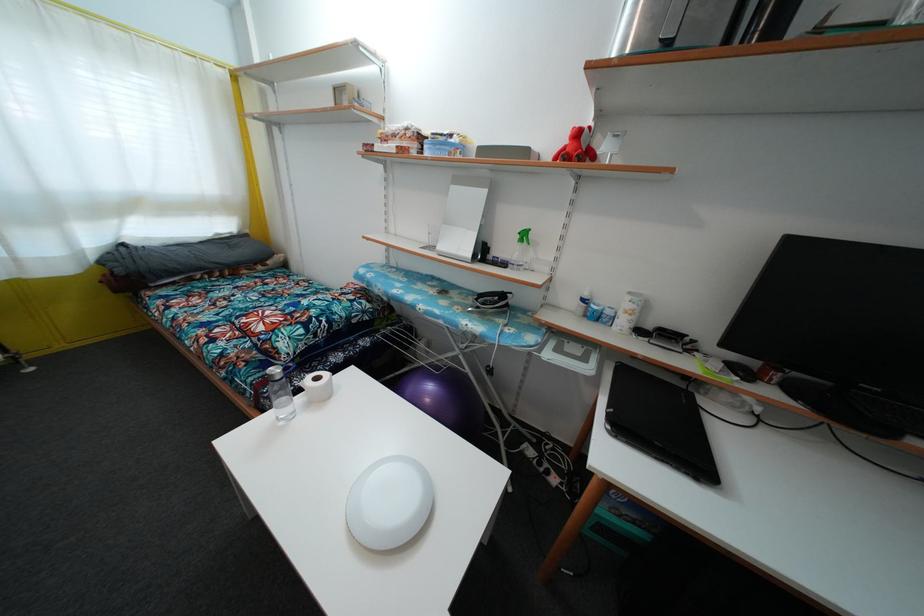
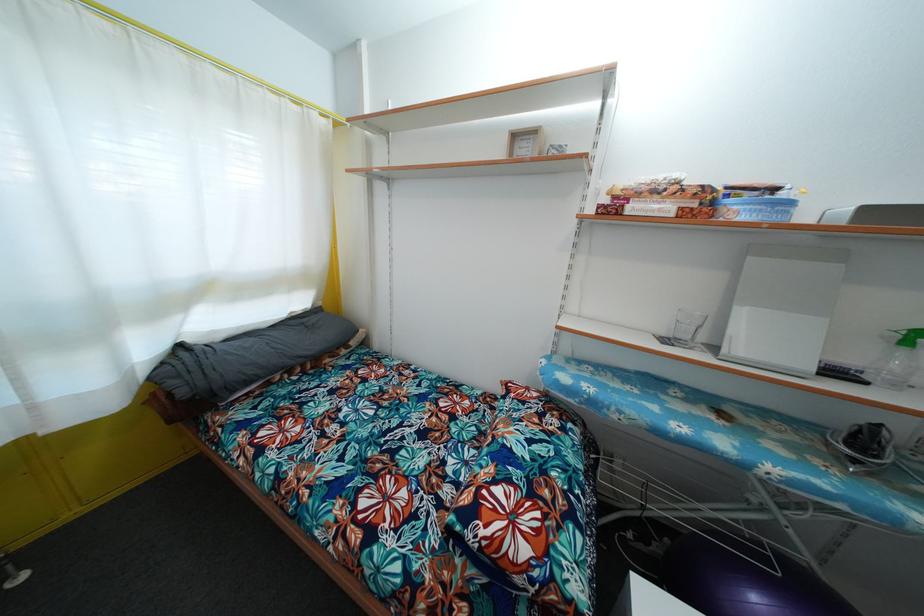
Find the pixel in the second image that matches point 410,136 in the first image.

(683, 188)